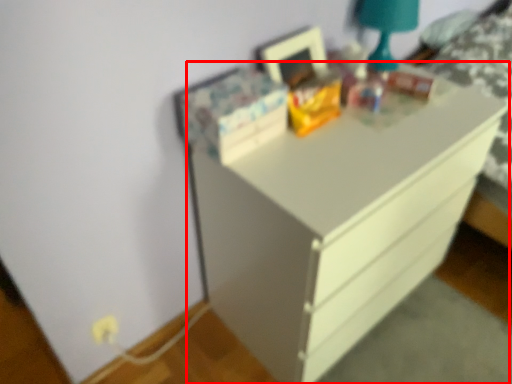
Question: In this image, where is chest of drawers (annotated by the red box) located relative to bedside lamp?

Choices:
 (A) right
 (B) left

Answer: (B)